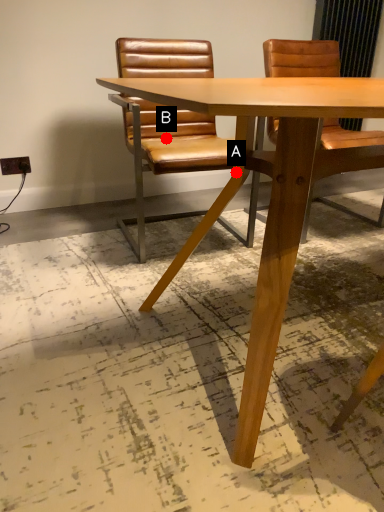
Question: Two points are circled on the image, labeled by A and B beside each circle. Which point appears farthest from the camera in this image?

Choices:
 (A) A is further
 (B) B is further

Answer: (B)